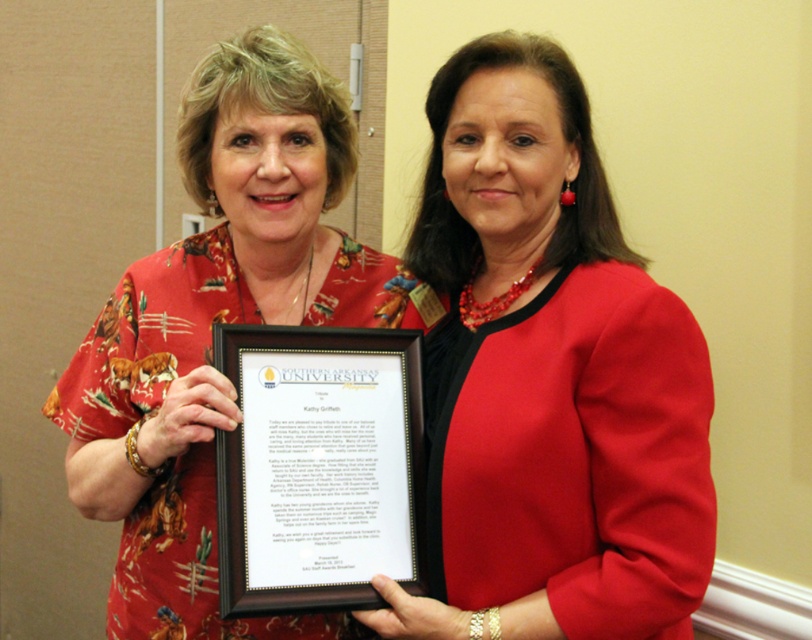
You are standing in front of the two women holding the framed certificate. You need to determine the relative positions of two specific points on the certificate. The first point is located at coordinates point [533,204], and the second is at point [266,285]. Which point is closer to you?

Point [533,204] is in front of point [266,285], so it is closer to you.

You are a fashion designer observing two women holding a certificate. You notice the matte red blazer at center and the floral fabric blouse at center. Which clothing item takes up more space in the scene?

The floral fabric blouse at center takes up more space than the matte red blazer at center.

Looking at this image, you are a photographer who needs to adjust the lighting to ensure both the matte red blazer at center and the black wood framed certificate at center are clearly visible. Which object requires more attention to avoid being overshadowed by the other?

The black wood framed certificate at center requires more attention because the matte red blazer at center is wider and might cast a shadow over it, making the certificate less visible.